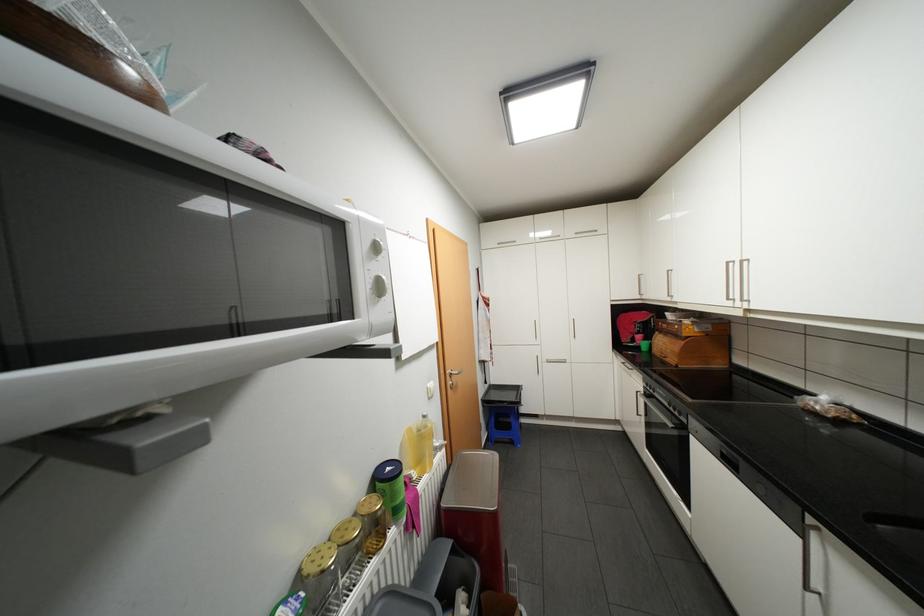
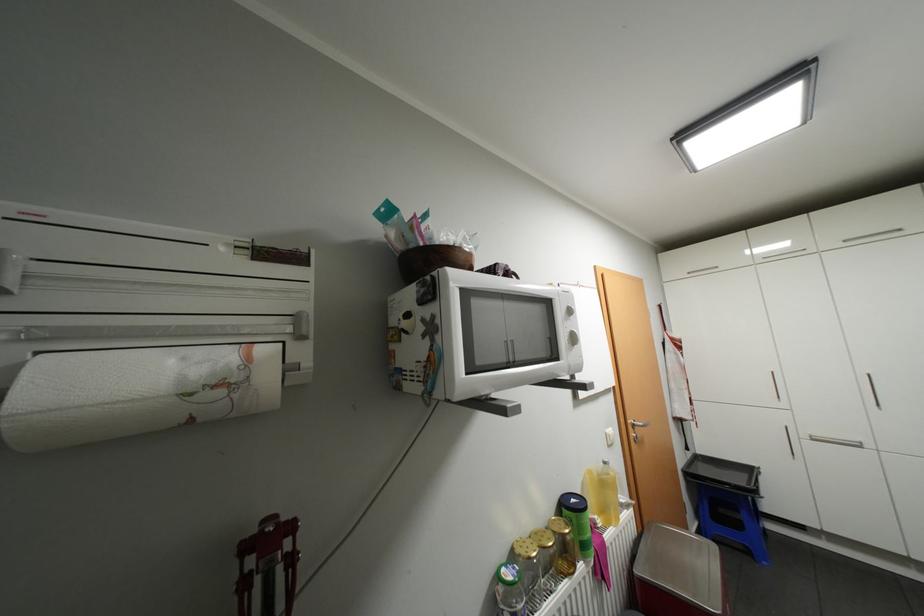
Find the pixel in the second image that matches (494,385) in the first image.

(697, 453)